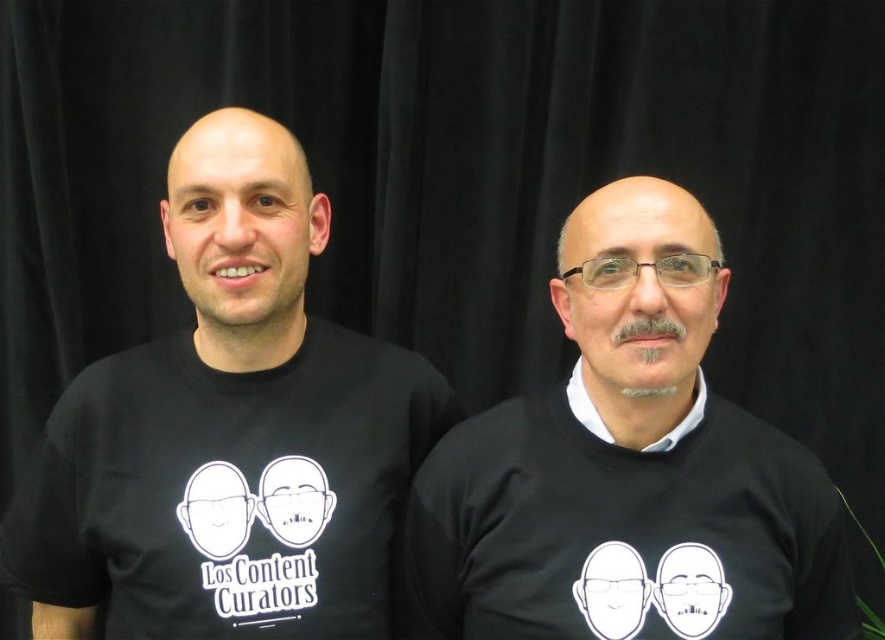
You are a photographer adjusting the focus on your camera. You notice two points in the image at coordinates point (x=794, y=609) and point (x=599, y=426). Which point should you focus on to ensure the subject closer to the camera is sharp?

Point (x=794, y=609) is further to the camera than point (x=599, y=426), so focusing on point (x=794, y=609) will ensure the subject closer to the camera is sharp.